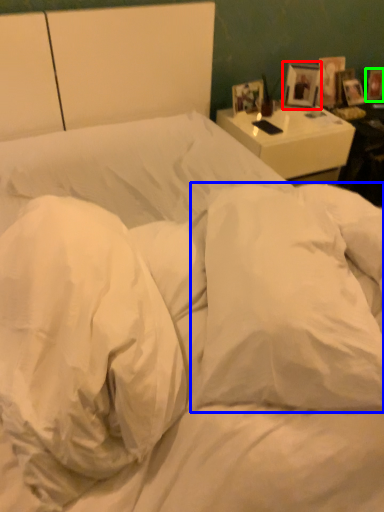
Question: Estimate the real-world distances between objects in this image. Which object is closer to picture frame (highlighted by a red box), pillow (highlighted by a blue box) or picture frame (highlighted by a green box)?

Choices:
 (A) pillow
 (B) picture frame

Answer: (B)